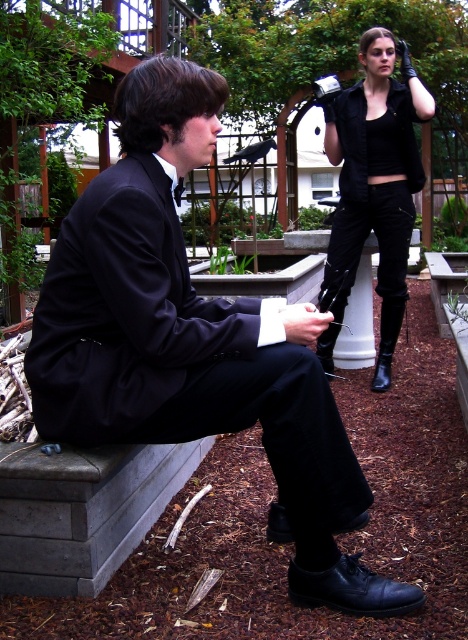
Question: Among these points, which one is nearest to the camera?

Choices:
 (A) (x=324, y=355)
 (B) (x=330, y=148)
 (C) (x=385, y=339)

Answer: (B)

Question: Does matte black vest at upper right appear over black leather boot at lower right?

Choices:
 (A) yes
 (B) no

Answer: (A)

Question: Which point is closer to the camera taking this photo?

Choices:
 (A) (387, 348)
 (B) (324, 346)
 (C) (394, 304)

Answer: (C)

Question: Does matte black vest at upper right appear under black leather boot at lower center?

Choices:
 (A) yes
 (B) no

Answer: (B)

Question: Which object appears closest to the camera in this image?

Choices:
 (A) black leather boot at lower center
 (B) black leather boot at lower right
 (C) matte black vest at upper right

Answer: (C)

Question: Is matte black vest at upper right to the right of black leather boot at lower center from the viewer's perspective?

Choices:
 (A) yes
 (B) no

Answer: (A)